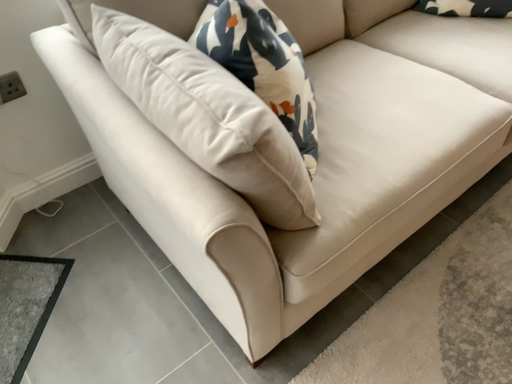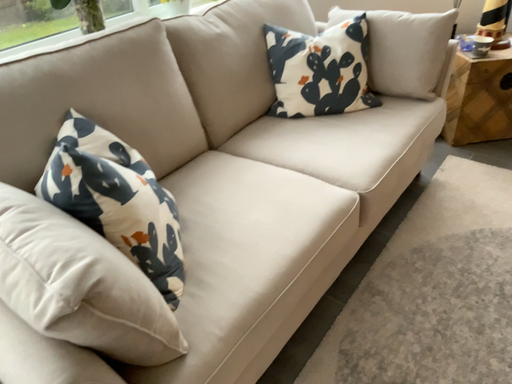
Question: How did the camera likely rotate when shooting the video?

Choices:
 (A) rotated right
 (B) rotated left

Answer: (A)